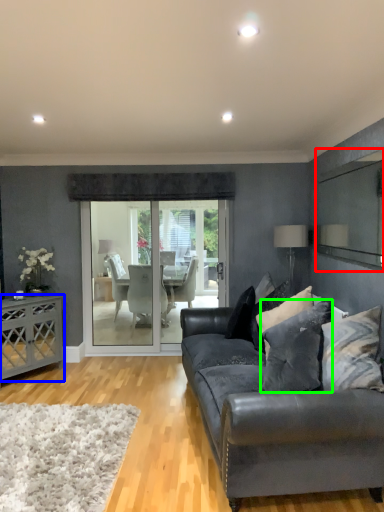
Question: Considering the real-world distances, which object is closest to mirror (highlighted by a red box)? desk (highlighted by a blue box) or pillow (highlighted by a green box).

Choices:
 (A) desk
 (B) pillow

Answer: (B)